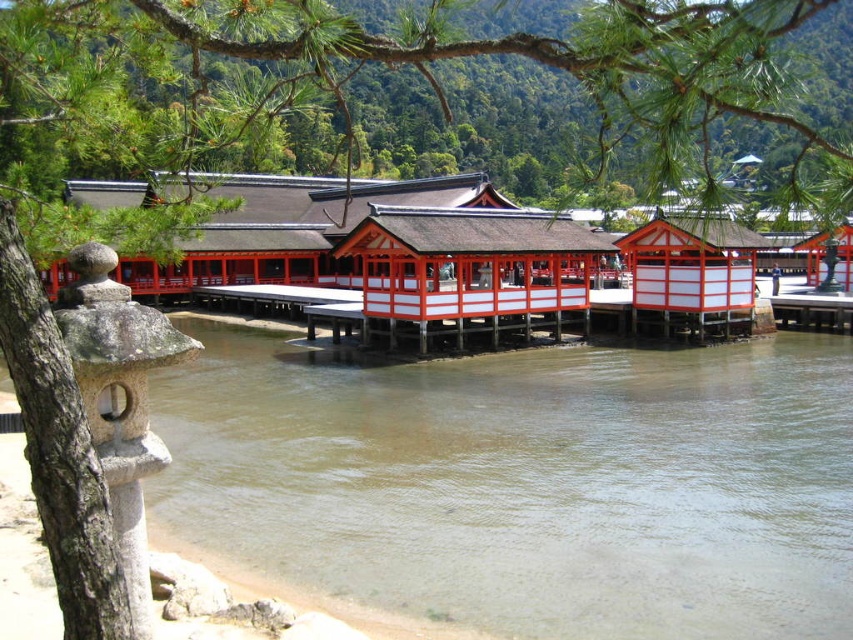
Is clear water at river left wider than green leafy branch at upper center?

Incorrect, clear water at river left's width does not surpass green leafy branch at upper center's.

Is point (801, 480) more distant than point (175, 131)?

That is False.

Which is in front, point (498, 384) or point (703, 112)?

Point (703, 112) is in front.

The height and width of the screenshot is (640, 853). Identify the location of clear water at river left. (529, 483).